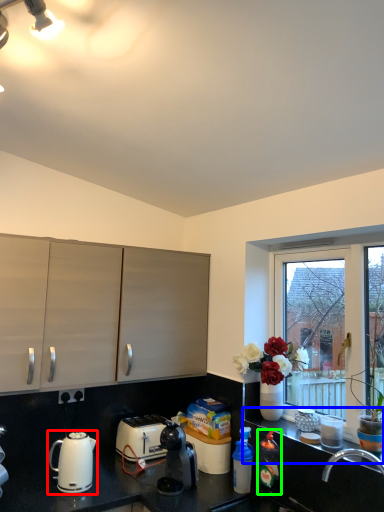
Question: Based on their relative distances, which object is farther from kettle (highlighted by a red box)? Choose from window sill (highlighted by a blue box) and bottle (highlighted by a green box).

Choices:
 (A) window sill
 (B) bottle

Answer: (A)